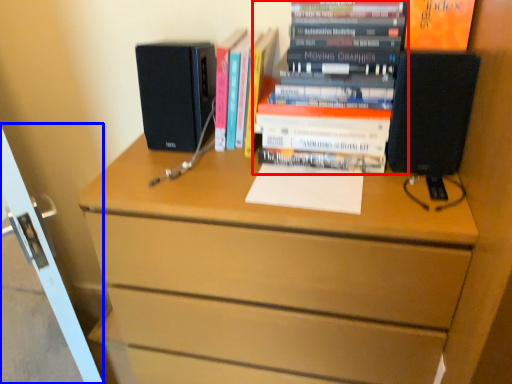
Question: Which object is further to the camera taking this photo, book (highlighted by a red box) or screen door (highlighted by a blue box)?

Choices:
 (A) book
 (B) screen door

Answer: (A)